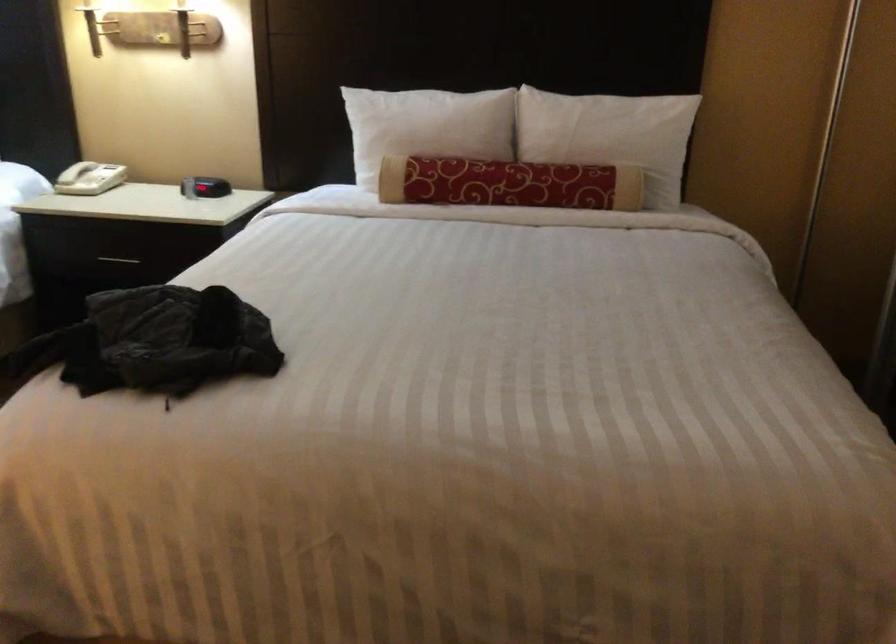
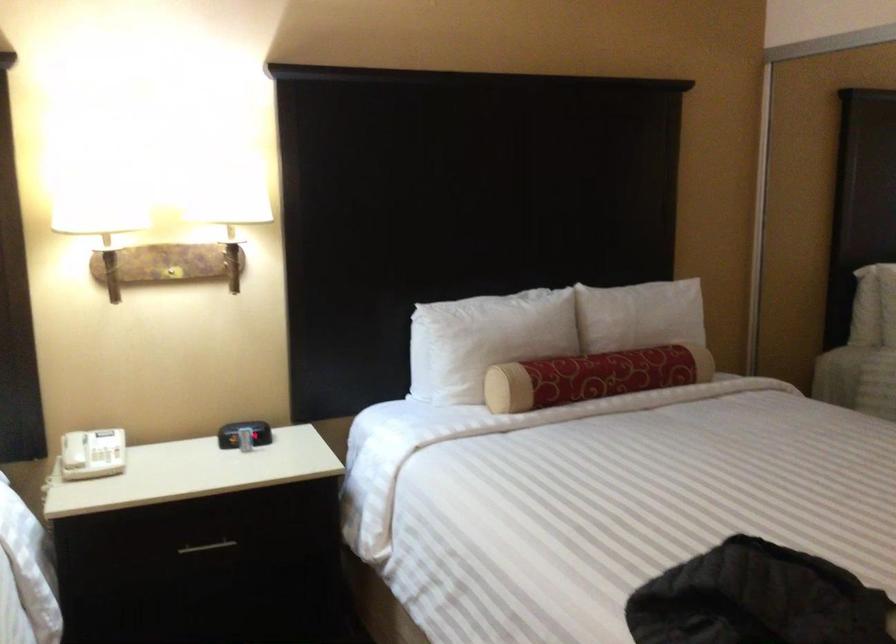
In the second image, find the point that corresponds to the point at 472,182 in the first image.

(592, 377)